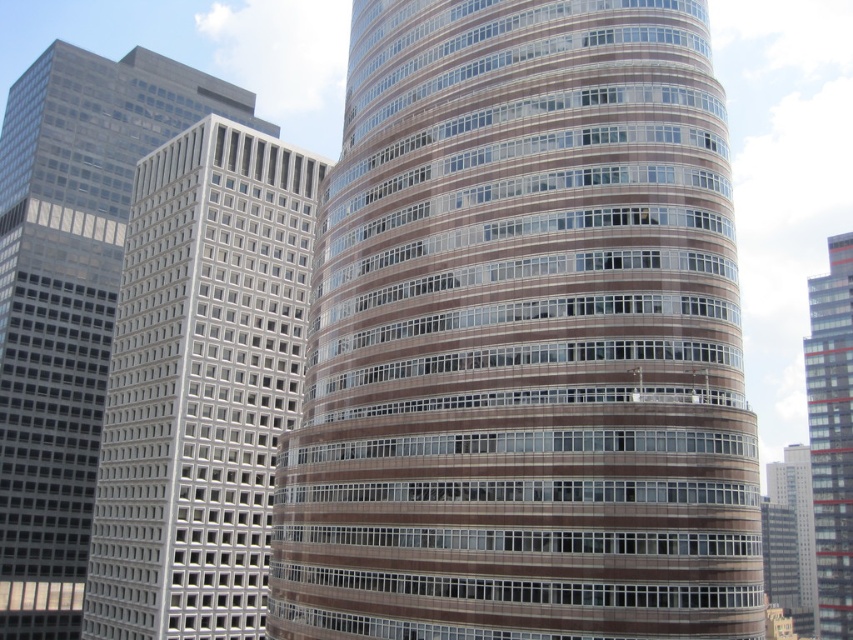
Can you confirm if brown glass building at center is bigger than gray glass skyscraper at right?

Incorrect, brown glass building at center is not larger than gray glass skyscraper at right.

Is point (453, 308) farther from viewer compared to point (798, 496)?

No, it is not.

Does point (653, 524) come behind point (792, 611)?

No, (653, 524) is in front of (792, 611).

You are a GUI agent. You are given a task and a screenshot of the screen. Output one action in this format:
    pyautogui.click(x=<x>, y=<y>)
    Task: Click on the brown glass building at center
    
    Given the screenshot: What is the action you would take?
    pyautogui.click(x=523, y=337)

Who is lower down, red glass building at right or gray glass skyscraper at right?

gray glass skyscraper at right

What are the coordinates of `red glass building at right` in the screenshot? It's located at (831, 435).

Between brown glass building at center and white glass building at center, which one is positioned lower?

white glass building at center is lower down.

Does brown glass building at center have a lesser width compared to white glass building at center?

Incorrect, brown glass building at center's width is not less than white glass building at center's.

Does point (537, 493) come behind point (114, 492)?

That is False.

At what (x,y) coordinates should I click in order to perform the action: click on brown glass building at center. Please return your answer as a coordinate pair (x, y). Looking at the image, I should click on (523, 337).